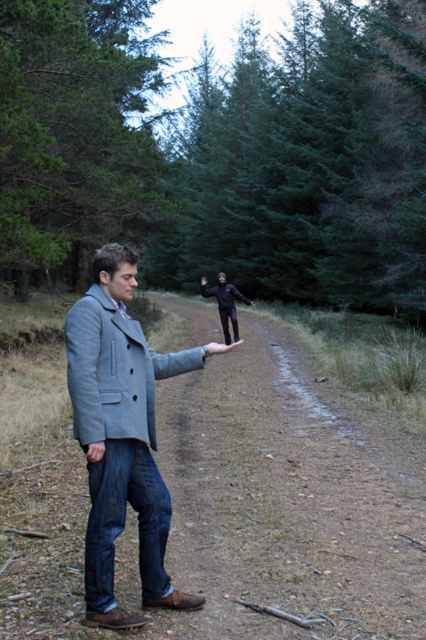
You are a hiker trying to follow the path. You see the brown dirt track at center and the black matte pants at center. Which one is closer to you?

The brown dirt track at center is closer to the viewer than the black matte pants at center.

You are a hiker trying to navigate through the green textured pine forest at upper center and the brown dirt track at center. Which path has a wider width for walking?

The green textured pine forest at upper center has a wider width than the brown dirt track at center, so it is wider for walking.

What is the coordinate of the brown dirt track at center?

The brown dirt track at center is located at coordinate point [238,509].